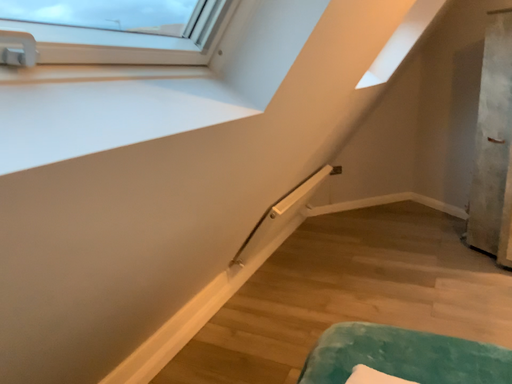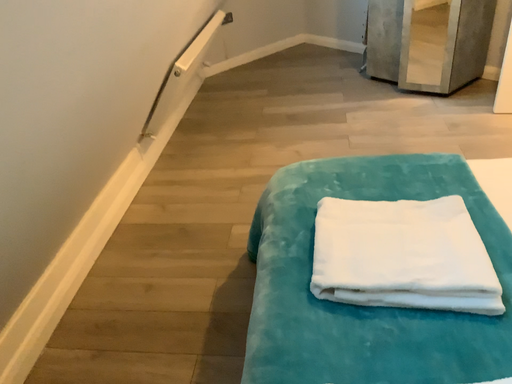
Question: How did the camera likely rotate when shooting the video?

Choices:
 (A) rotated downward
 (B) rotated upward

Answer: (A)